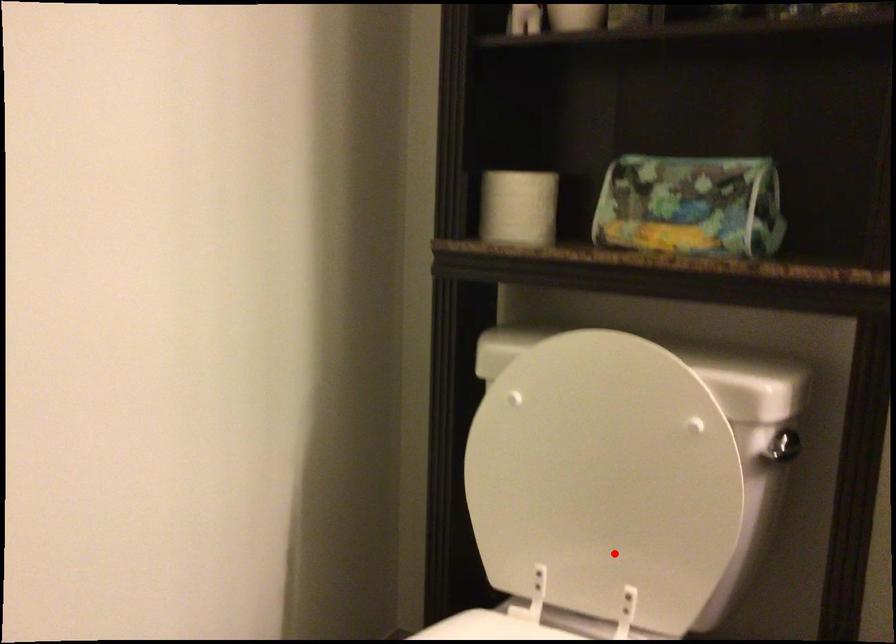
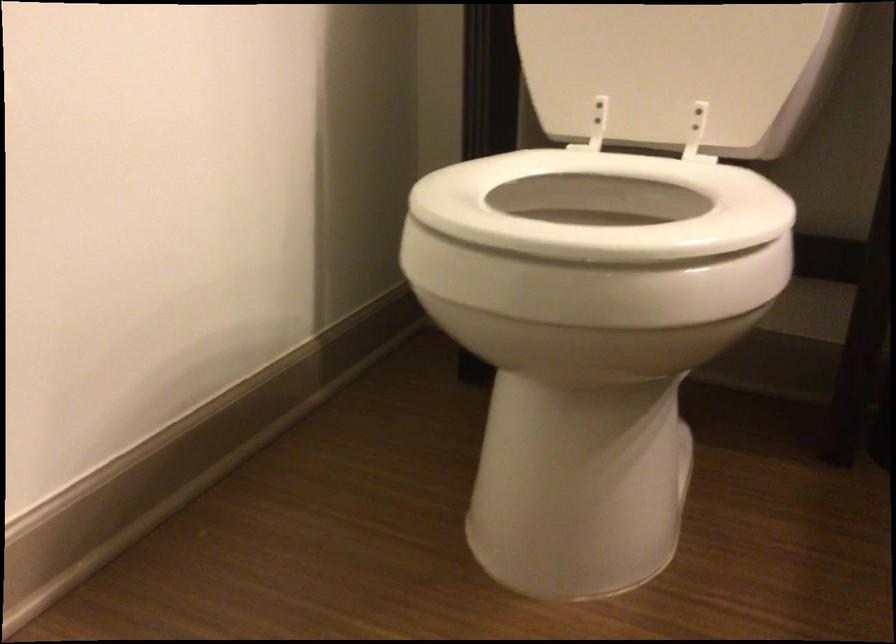
Where in the second image is the point corresponding to the highlighted location from the first image?

(677, 71)